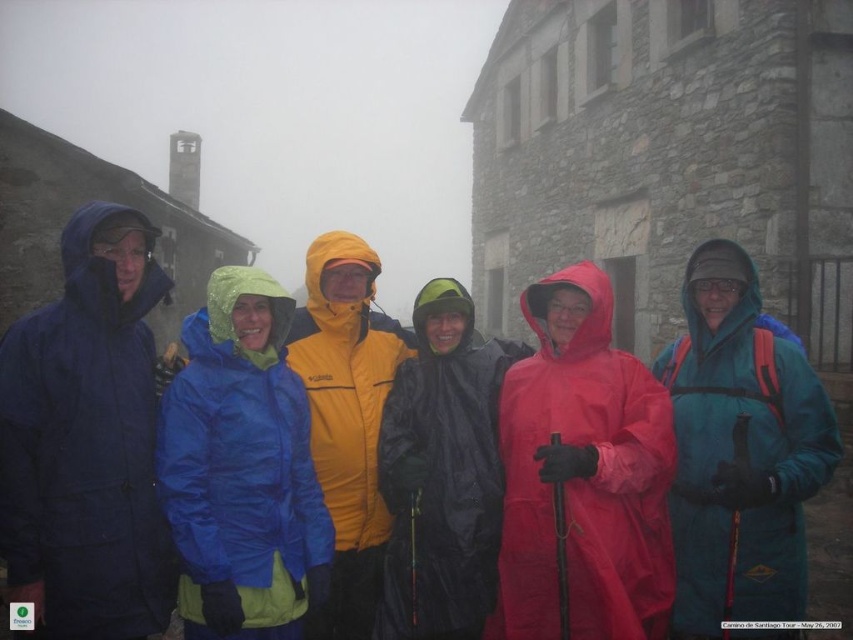
Does rubberized red raincoat at center appear on the left side of blue waterproof jacket at center?

No, rubberized red raincoat at center is not to the left of blue waterproof jacket at center.

Locate an element on the screen. Image resolution: width=853 pixels, height=640 pixels. rubberized red raincoat at center is located at coordinates (583, 474).

Which is behind, point (606, 420) or point (218, 307)?

The point (218, 307) is more distant.

Locate an element on the screen. Image resolution: width=853 pixels, height=640 pixels. rubberized red raincoat at center is located at coordinates (583, 474).

Consider the image. Can you confirm if teal waterproof jacket at center is positioned below black waterproof jacket at center?

Correct, teal waterproof jacket at center is located below black waterproof jacket at center.

Can you confirm if teal waterproof jacket at center is positioned to the left of black waterproof jacket at center?

No, teal waterproof jacket at center is not to the left of black waterproof jacket at center.

At what (x,y) coordinates should I click in order to perform the action: click on teal waterproof jacket at center. Please return your answer as a coordinate pair (x, y). Looking at the image, I should click on (740, 454).

Does matte blue raincoat at left have a smaller size compared to black waterproof jacket at center?

No, matte blue raincoat at left is not smaller than black waterproof jacket at center.

Is matte blue raincoat at left to the right of black waterproof jacket at center from the viewer's perspective?

Incorrect, matte blue raincoat at left is not on the right side of black waterproof jacket at center.

The width and height of the screenshot is (853, 640). What do you see at coordinates (86, 440) in the screenshot? I see `matte blue raincoat at left` at bounding box center [86, 440].

Find the location of a particular element. The image size is (853, 640). matte blue raincoat at left is located at coordinates 86,440.